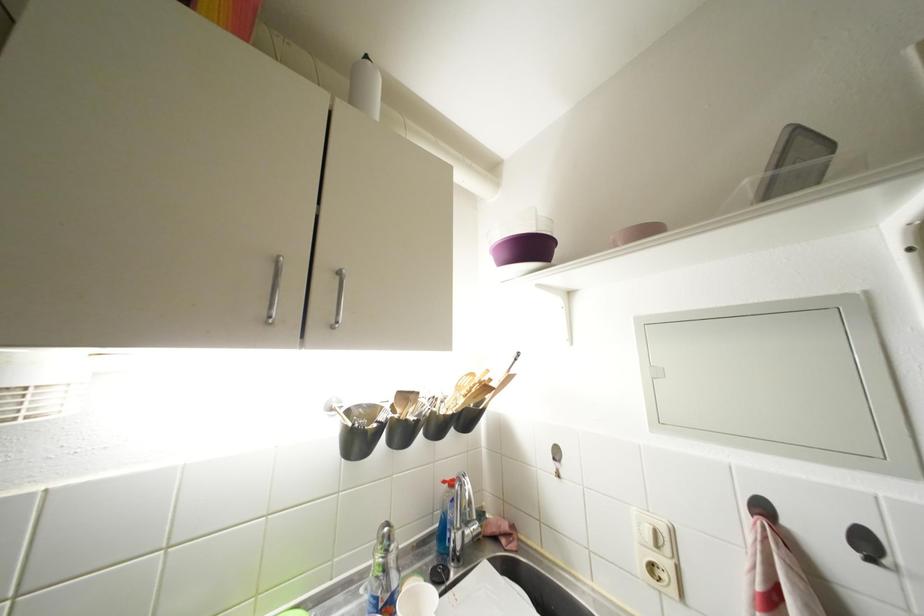
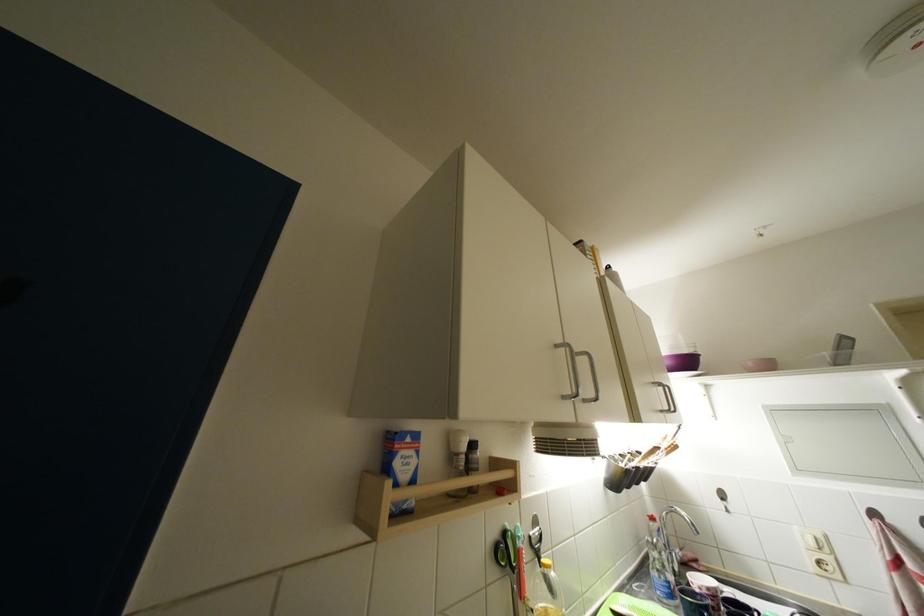
What movement of the cameraman would produce the second image?

The cameraman moved toward left, backward.